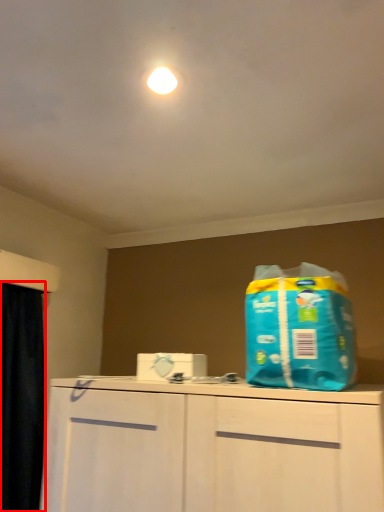
Question: From the image's perspective, what is the correct spatial positioning of curtain (annotated by the red box) in reference to cleaning product?

Choices:
 (A) below
 (B) above

Answer: (A)